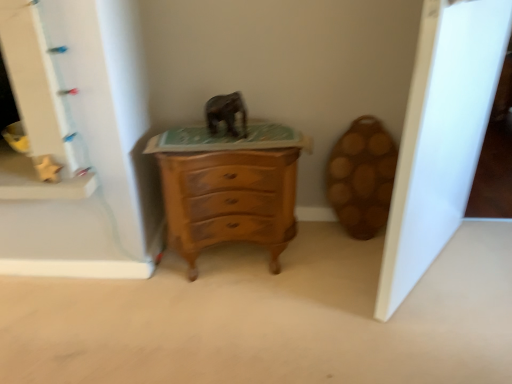
Question: Does matte gray elephant at center have a lesser height compared to wooden chest of drawers at center?

Choices:
 (A) no
 (B) yes

Answer: (B)

Question: Could wooden chest of drawers at center be considered to be inside matte gray elephant at center?

Choices:
 (A) no
 (B) yes

Answer: (A)

Question: Is matte gray elephant at center not near wooden chest of drawers at center?

Choices:
 (A) yes
 (B) no

Answer: (B)

Question: Can you confirm if matte gray elephant at center is positioned to the right of wooden chest of drawers at center?

Choices:
 (A) no
 (B) yes

Answer: (A)

Question: Can you confirm if matte gray elephant at center is taller than wooden chest of drawers at center?

Choices:
 (A) yes
 (B) no

Answer: (B)

Question: Can you confirm if matte gray elephant at center is thinner than wooden chest of drawers at center?

Choices:
 (A) yes
 (B) no

Answer: (A)

Question: Considering the relative sizes of matte gray elephant at center and white glossy door at right in the image provided, is matte gray elephant at center taller than white glossy door at right?

Choices:
 (A) yes
 (B) no

Answer: (B)

Question: From a real-world perspective, is matte gray elephant at center on white glossy door at right?

Choices:
 (A) yes
 (B) no

Answer: (A)

Question: Can you confirm if matte gray elephant at center is thinner than white glossy door at right?

Choices:
 (A) no
 (B) yes

Answer: (B)

Question: Is matte gray elephant at center located outside white glossy door at right?

Choices:
 (A) yes
 (B) no

Answer: (A)

Question: Considering the relative sizes of matte gray elephant at center and white glossy door at right in the image provided, is matte gray elephant at center shorter than white glossy door at right?

Choices:
 (A) yes
 (B) no

Answer: (A)

Question: From the image's perspective, is matte gray elephant at center above white glossy door at right?

Choices:
 (A) yes
 (B) no

Answer: (A)

Question: Is wooden chest of drawers at center not within matte gray elephant at center?

Choices:
 (A) no
 (B) yes

Answer: (B)